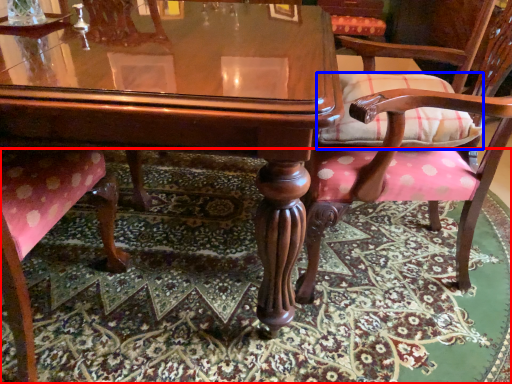
Question: Which of the following is the closest to the observer, mat (highlighted by a red box) or pillow (highlighted by a blue box)?

Choices:
 (A) mat
 (B) pillow

Answer: (A)